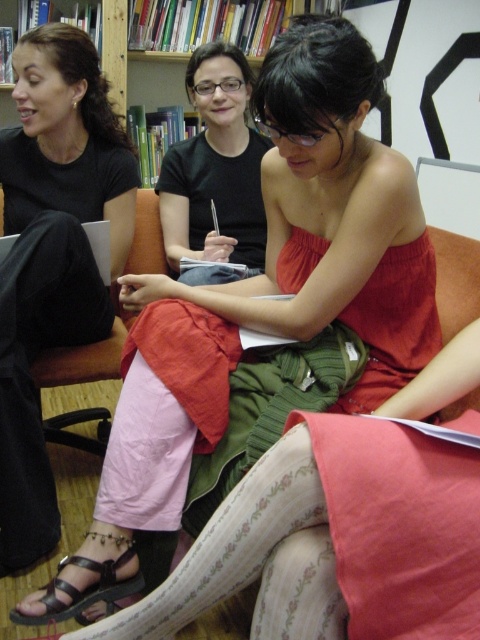
Question: Is matte black shirt at center to the right of black leather sandal at lower left from the viewer's perspective?

Choices:
 (A) no
 (B) yes

Answer: (B)

Question: Among these objects, which one is farthest from the camera?

Choices:
 (A) pink fabric skirt at lower left
 (B) matte black shirt at center
 (C) black leather sandal at lower left

Answer: (B)

Question: Does matte black shirt at center have a lesser width compared to black leather sandal at lower left?

Choices:
 (A) no
 (B) yes

Answer: (A)

Question: Does pink fabric skirt at lower left have a smaller size compared to matte black shirt at center?

Choices:
 (A) yes
 (B) no

Answer: (B)

Question: Which of the following is the closest to the observer?

Choices:
 (A) black leather sandal at lower left
 (B) pink fabric skirt at lower left

Answer: (A)

Question: Which object is farther from the camera taking this photo?

Choices:
 (A) matte red dress at center
 (B) matte black shirt at center

Answer: (B)